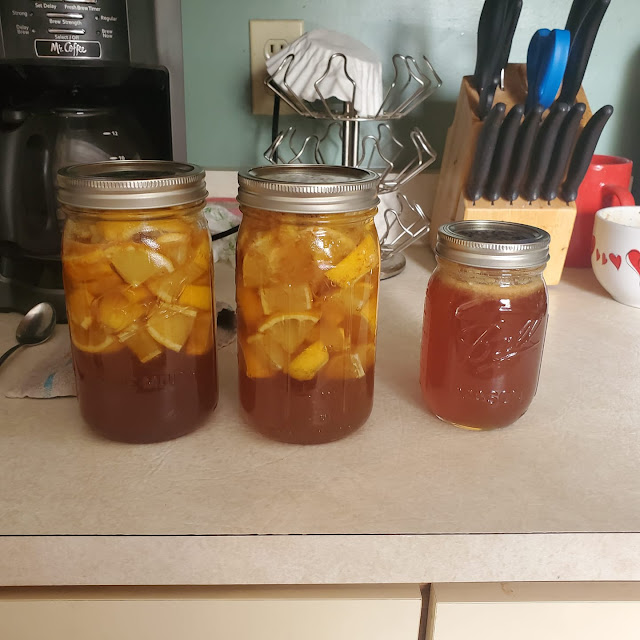
In order to click on cup in this screenshot , I will do `click(623, 221)`.